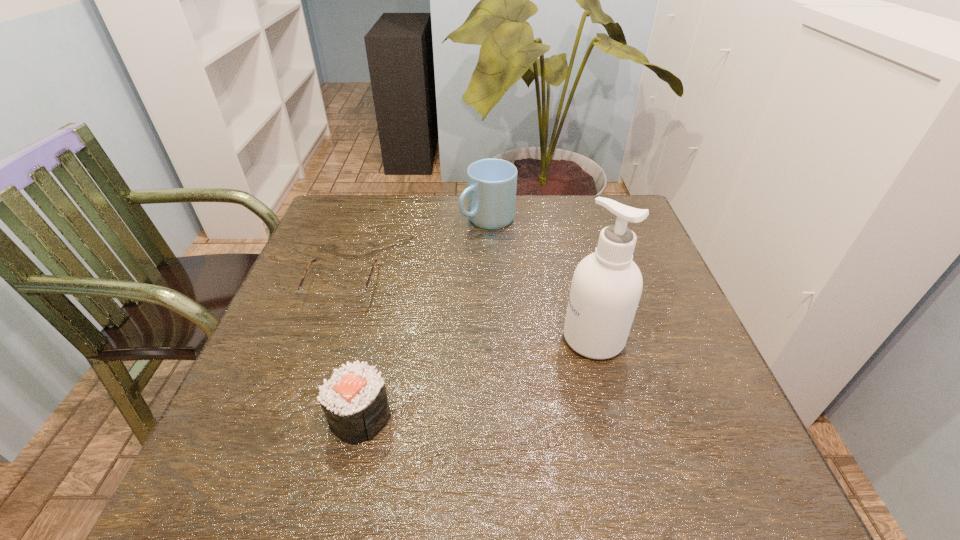
You are a GUI agent. You are given a task and a screenshot of the screen. Output one action in this format:
    pyautogui.click(x=<x>, y=<y>)
    Task: Click on the rightmost object
    
    Given the screenshot: What is the action you would take?
    pyautogui.click(x=606, y=287)

What are the coordinates of `the second nearest object` in the screenshot? It's located at (606, 287).

Locate an element on the screen. This screenshot has width=960, height=540. mug is located at coordinates (491, 188).

Identify the location of the third shortest object. (491, 188).

Locate an element on the screen. The height and width of the screenshot is (540, 960). sushi is located at coordinates (354, 399).

Locate an element on the screen. This screenshot has width=960, height=540. the nearest object is located at coordinates (354, 399).

Locate an element on the screen. This screenshot has height=540, width=960. the shortest object is located at coordinates (347, 299).

At what (x,y) coordinates should I click in order to perform the action: click on spectacles. Please return your answer as a coordinate pair (x, y). This screenshot has height=540, width=960. Looking at the image, I should click on (347, 299).

You are a GUI agent. You are given a task and a screenshot of the screen. Output one action in this format:
    pyautogui.click(x=<x>, y=<y>)
    Task: Click on the free space located 0.290m on the front label of the third farthest object
    This screenshot has height=540, width=960.
    Given the screenshot: What is the action you would take?
    pyautogui.click(x=425, y=338)

The width and height of the screenshot is (960, 540). I want to click on blank area located 0.170m on the front label of the third farthest object, so click(482, 338).